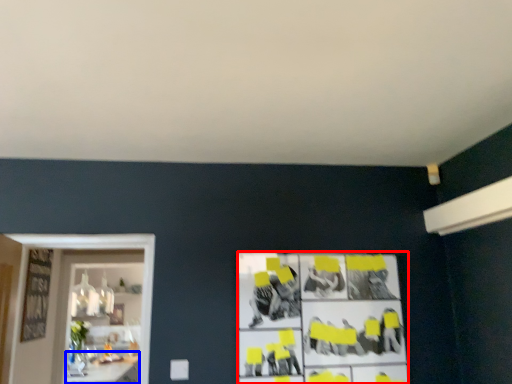
Question: Which object is further to the camera taking this photo, poster (highlighted by a red box) or table (highlighted by a blue box)?

Choices:
 (A) poster
 (B) table

Answer: (B)